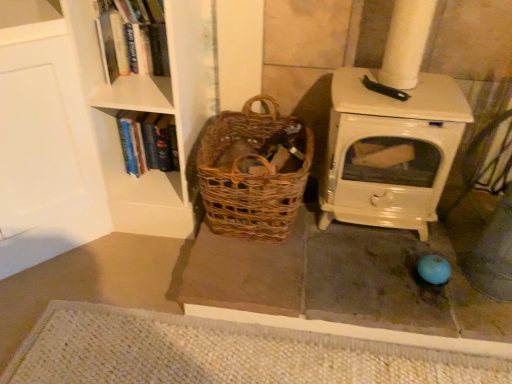
Image resolution: width=512 pixels, height=384 pixels. Find the location of `free space above white woven mat at lower center (from a real-world perspective)`. free space above white woven mat at lower center (from a real-world perspective) is located at coordinates (180, 357).